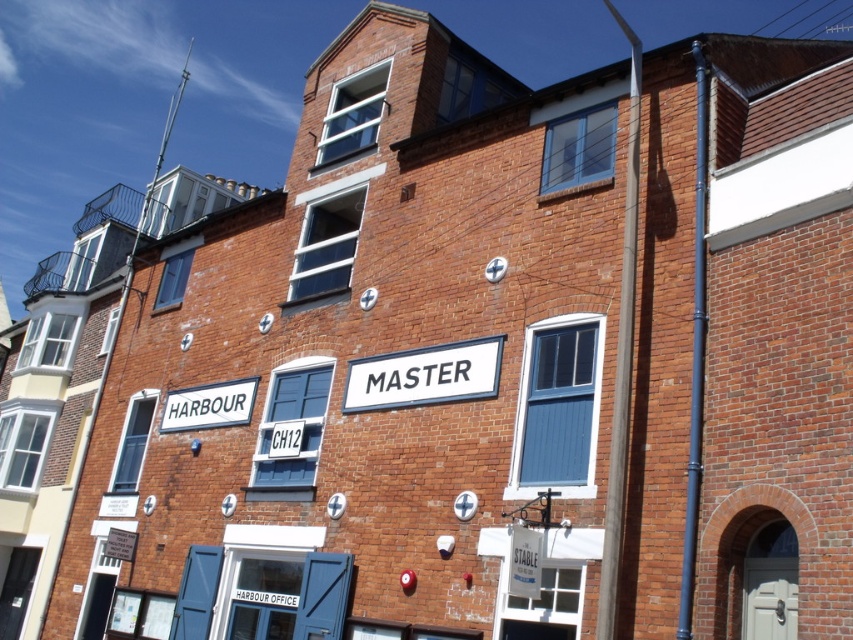
You are standing at the base of the brick building and want to take a photo of the white plastic sign at center. If your camera has a maximum focus range of 120 feet, will it be able to focus on the sign?

The white plastic sign at center is 119.36 feet away from the camera. Since this distance is within the camera maximum focus range of 120 feet, the camera can focus on the sign.